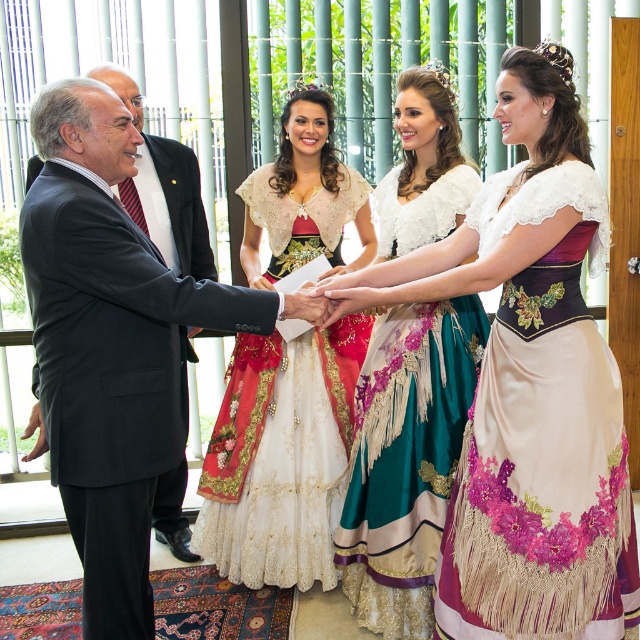
You are standing at the point labeled as point (593,237) in the image. You want to hand a document to the man in the dark suit on the left side of the frame. Can you reach him without moving from your current position? The man is 1.8 meters tall.

The distance between you and the man in the dark suit is 1.99 meters. Since the man is 1.8 meters tall, you would need to extend your arm to reach him. However, the distance is slightly beyond typical arm length, so you might need to take a small step forward to ensure you can hand him the document comfortably.

You are a photographer at the event and need to capture a clear photo of both the purple satin dress at center and the silk satin dress at center. Which dress should you focus on first to ensure both are in focus?

You should focus on the purple satin dress at center first since it is closer to the viewer than the silk satin dress at center. By focusing on the closer dress, the depth of field may also capture the silk satin dress at center in focus.

You are a photographer at the event and need to adjust the lighting between the purple satin dress at center and the silk satin dress at center. The minimum required distance for proper lighting is 40 centimeters. Can the current spacing between them accommodate the lighting setup?

The distance between the purple satin dress at center and the silk satin dress at center is 38.05 centimeters, which is less than the required 40 centimeters. Therefore, the current spacing is insufficient for the lighting setup.